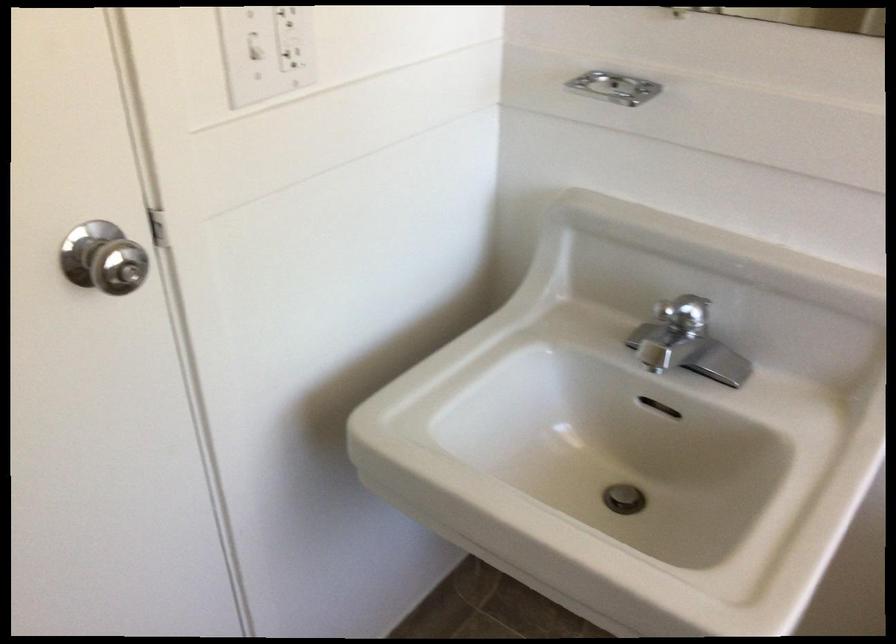
Where would you lift the faucet handle? Please return your answer as a coordinate pair (x, y).

(673, 332)